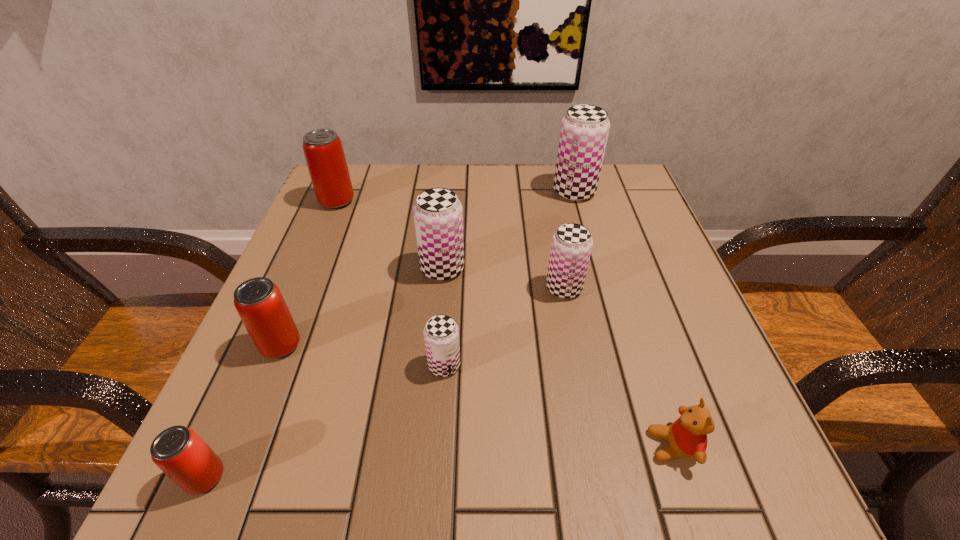
Locate an element on the screen. The width and height of the screenshot is (960, 540). beer can positioned at the near edge is located at coordinates (178, 451).

Image resolution: width=960 pixels, height=540 pixels. Find the location of `teddy bear at the near edge`. teddy bear at the near edge is located at coordinates (687, 436).

Identify the location of beer can located in the right edge section of the desktop. This screenshot has height=540, width=960. (584, 131).

At what (x,y) coordinates should I click in order to perform the action: click on teddy bear that is at the right edge. Please return your answer as a coordinate pair (x, y). Image resolution: width=960 pixels, height=540 pixels. Looking at the image, I should click on (687, 436).

Identify the location of object that is at the far left corner. The height and width of the screenshot is (540, 960). [323, 150].

You are a GUI agent. You are given a task and a screenshot of the screen. Output one action in this format:
    pyautogui.click(x=<x>, y=<y>)
    Task: Click on the object located in the near left corner section of the desktop
    The width and height of the screenshot is (960, 540).
    Given the screenshot: What is the action you would take?
    pyautogui.click(x=178, y=451)

Identify the location of object at the far right corner. The height and width of the screenshot is (540, 960). (584, 131).

Identify the location of object present at the near right corner. (687, 436).

In the image, there is a desktop. Identify the location of vacant space at the far edge. (529, 208).

This screenshot has width=960, height=540. I want to click on free region at the near edge, so click(x=403, y=467).